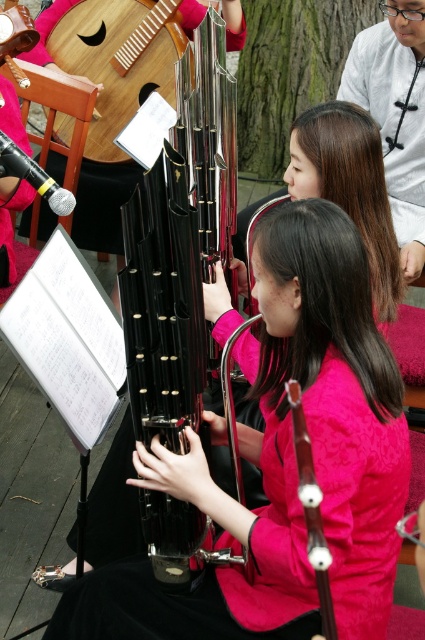
Can you confirm if wooden acoustic guitar at upper left is positioned to the right of wooden string instrument at center?

Incorrect, wooden acoustic guitar at upper left is not on the right side of wooden string instrument at center.

Is wooden acoustic guitar at upper left positioned in front of wooden string instrument at center?

No.

Does point (59, 118) come in front of point (320, 576)?

That is False.

Identify the location of wooden acoustic guitar at upper left. (119, 60).

Is black glossy bassoon at center wider than wooden acoustic guitar at upper left?

Yes, black glossy bassoon at center is wider than wooden acoustic guitar at upper left.

Between black glossy bassoon at center and wooden acoustic guitar at upper left, which one appears on the right side from the viewer's perspective?

From the viewer's perspective, black glossy bassoon at center appears more on the right side.

Is point (357, 240) positioned after point (93, 52)?

No, it is not.

This screenshot has height=640, width=425. I want to click on black glossy bassoon at center, so click(x=283, y=461).

Does point (376, 68) come in front of point (308, 529)?

No, (376, 68) is behind (308, 529).

Is matte pink sweater at center taller than wooden string instrument at center?

Indeed, matte pink sweater at center has a greater height compared to wooden string instrument at center.

Which is in front, point (387, 76) or point (305, 515)?

Point (305, 515)

Identify the location of matte pink sweater at center. The width and height of the screenshot is (425, 640). (396, 115).